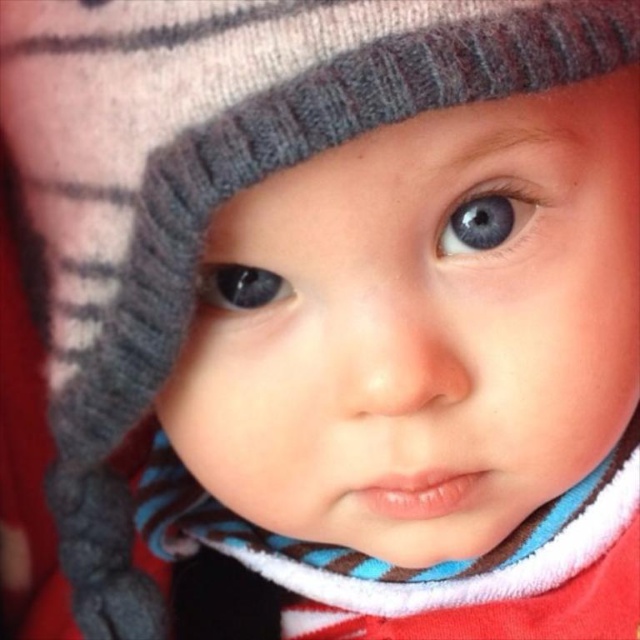
Which is behind, point (614, 513) or point (502, 188)?

The point (614, 513) is more distant.

Does blue striped scarf at center appear on the left side of blue matte eye at upper center?

Correct, you'll find blue striped scarf at center to the left of blue matte eye at upper center.

Describe the element at coordinates (426, 566) in the screenshot. I see `blue striped scarf at center` at that location.

I want to click on blue striped scarf at center, so click(x=426, y=566).

Does blue striped scarf at center have a lesser width compared to matte blue eye at center?

Incorrect, blue striped scarf at center's width is not less than matte blue eye at center's.

I want to click on blue striped scarf at center, so click(x=426, y=566).

Consider the image. Is blue matte eye at upper center below matte blue eye at center?

Actually, blue matte eye at upper center is above matte blue eye at center.

Who is more distant from viewer, (502, 193) or (225, 301)?

The point (225, 301) is more distant.

Is point (444, 241) positioned behind point (244, 292)?

No, it is not.

Locate an element on the screen. The image size is (640, 640). blue matte eye at upper center is located at coordinates (484, 218).